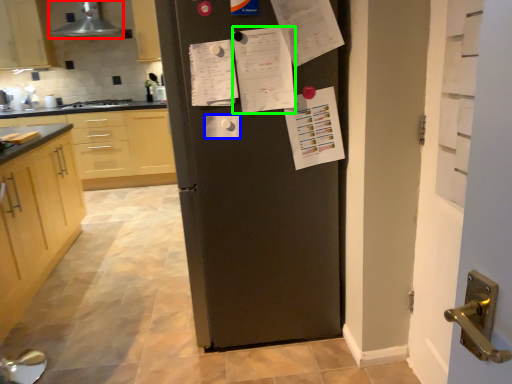
Question: Which object is the farthest from exhaust hood (highlighted by a red box)? Choose among these: paper (highlighted by a blue box) or list (highlighted by a green box).

Choices:
 (A) paper
 (B) list

Answer: (A)